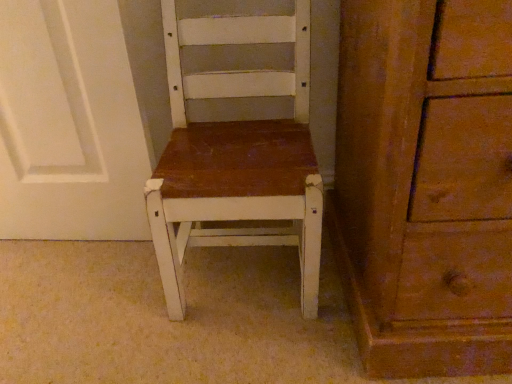
The image size is (512, 384). Identify the location of free spot in front of matte white chair at center. (244, 349).